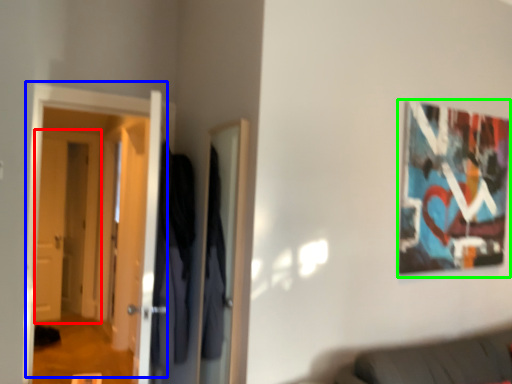
Question: Which object is positioned farthest from door (highlighted by a red box)? Select from door (highlighted by a blue box) and picture frame (highlighted by a green box).

Choices:
 (A) door
 (B) picture frame

Answer: (B)